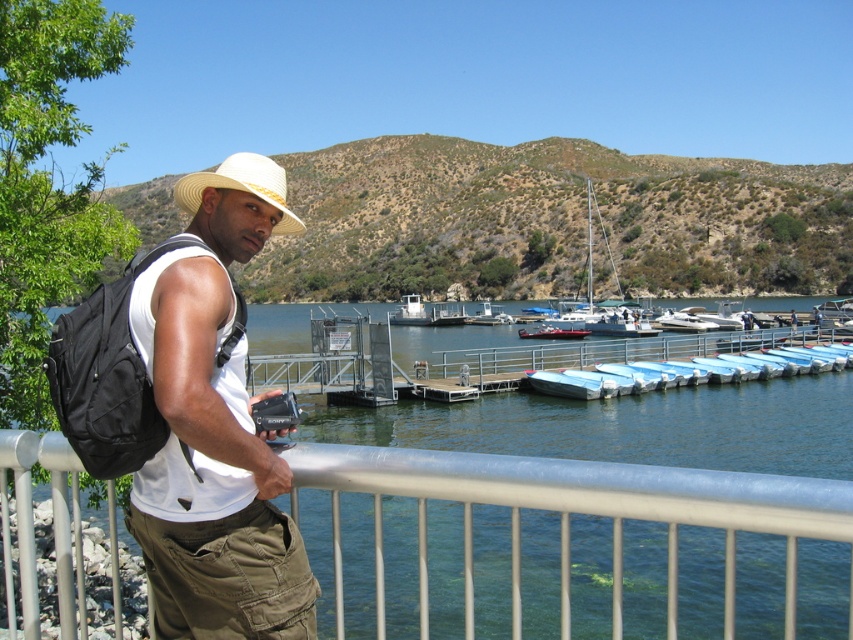
You are a photographer standing at the edge of the dock. You notice the silver metallic fence at lower center and the beige straw hat at center. Which object is closer to the water?

The silver metallic fence at lower center is positioned under the beige straw hat at center, meaning it is closer to the water than the hat.

You are a photographer standing at the edge of a pier, holding a camera. You notice the silver metallic fence at lower center and the beige straw hat at center. If you want to capture both objects in a single photo without moving your position, will their distance apart allow it? Please explain based on their separation.

The silver metallic fence at lower center and the beige straw hat at center are 14.17 meters apart from each other. Since the photographer is at the edge of the pier and wants to capture both in a single photo without moving, the distance between them may be too large to fit in the frame unless using a wide angle lens. However, the exact feasibility depends on the camera lens used. But according to the given information, the separation is 14.17 meters which is quite substantial, so it might be challenging.